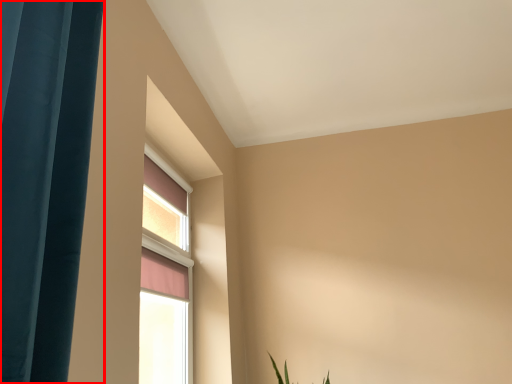
Question: From the image's perspective, what is the correct spatial positioning of curtain (annotated by the red box) in reference to window?

Choices:
 (A) above
 (B) below

Answer: (A)